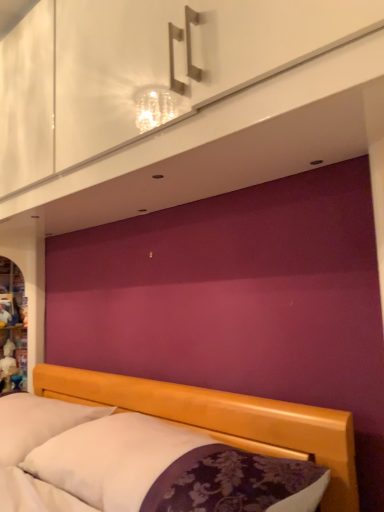
Question: From a real-world perspective, is wooden bed at lower center positioned above or below white soft pillow at lower left?

Choices:
 (A) below
 (B) above

Answer: (B)

Question: Is wooden bed at lower center to the left or to the right of white soft pillow at lower left in the image?

Choices:
 (A) left
 (B) right

Answer: (B)

Question: Estimate the real-world distances between objects in this image. Which object is closer to the white glossy dresser at upper center?

Choices:
 (A) matte white cabinet at left
 (B) wooden bed at lower center
 (C) white soft pillow at lower left

Answer: (B)

Question: Which of these objects is positioned farthest from the white glossy dresser at upper center?

Choices:
 (A) matte white cabinet at left
 (B) wooden bed at lower center
 (C) white soft pillow at lower left

Answer: (A)